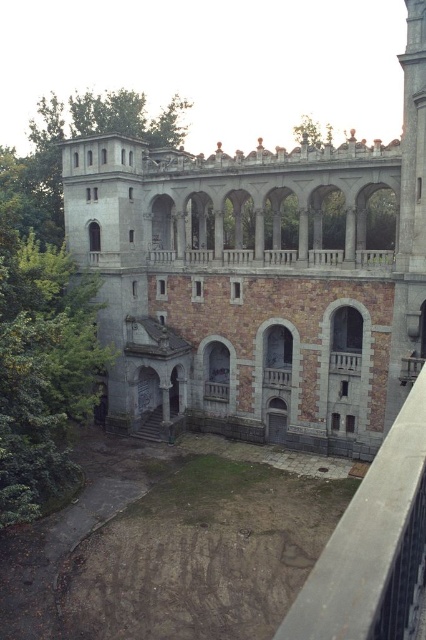
You are an architect examining the building. You notice the stone gray palace at center and the gray concrete rail at center. Which one is located higher up in the structure?

The stone gray palace at center is positioned over the gray concrete rail at center, so it is higher up in the structure.

You are an architect inspecting the building and need to determine which object has a greater width between the gray concrete rail at center and the smooth stone balcony at center. Based on the scene, which one is wider?

The gray concrete rail at center is wider than the smooth stone balcony at center according to the description provided.